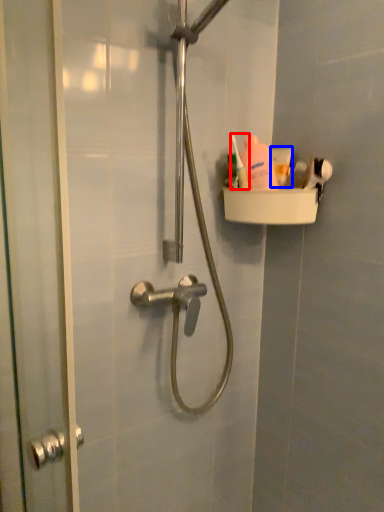
Question: Which object is closer to the camera taking this photo, toiletry (highlighted by a red box) or toothpaste (highlighted by a blue box)?

Choices:
 (A) toiletry
 (B) toothpaste

Answer: (A)